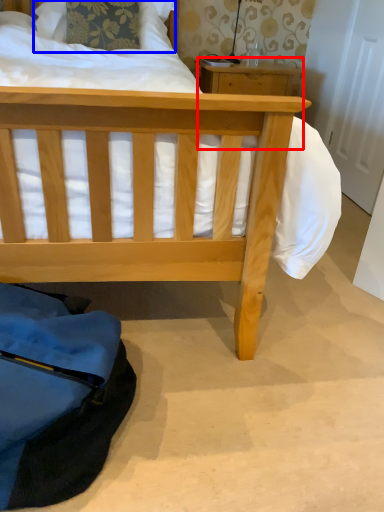
Question: Which object is further to the camera taking this photo, table (highlighted by a red box) or pillow (highlighted by a blue box)?

Choices:
 (A) table
 (B) pillow

Answer: (A)